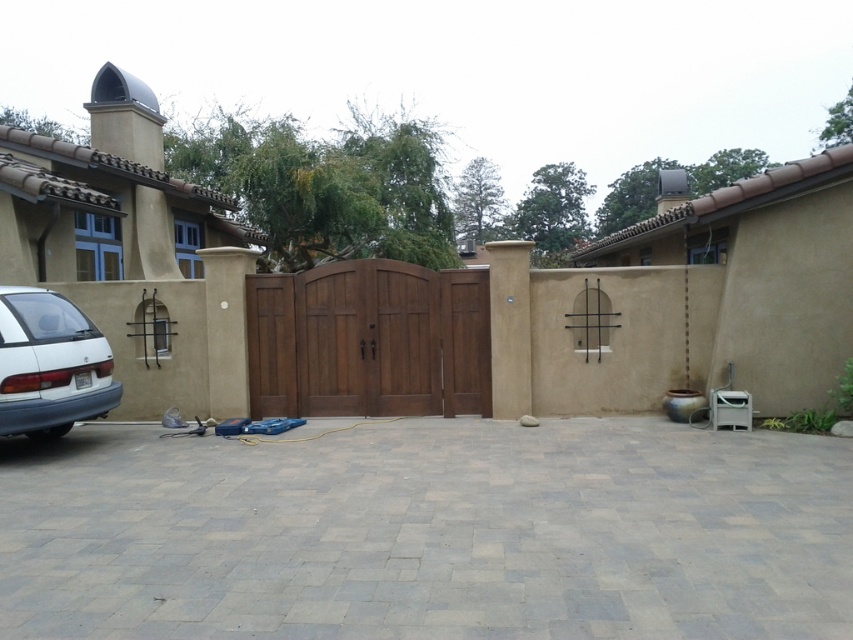
Which is more to the right, white matte hatchback at lower left or wooden gate at center?

From the viewer's perspective, wooden gate at center appears more on the right side.

This screenshot has width=853, height=640. I want to click on white matte hatchback at lower left, so click(x=50, y=364).

Where is `white matte hatchback at lower left`? The height and width of the screenshot is (640, 853). white matte hatchback at lower left is located at coordinates (50, 364).

Image resolution: width=853 pixels, height=640 pixels. Identify the location of gray paver driveway at center. (430, 532).

Is gray paver driveway at center bigger than brown wooden door at center?

Actually, gray paver driveway at center might be smaller than brown wooden door at center.

Which is behind, point (604, 636) or point (490, 416)?

Point (490, 416)

Where is `gray paver driveway at center`? This screenshot has width=853, height=640. gray paver driveway at center is located at coordinates (430, 532).

Is gray paver driveway at center thinner than wooden gate at center?

No.

Between point (231, 484) and point (267, 355), which one is positioned in front?

Positioned in front is point (231, 484).

At what (x,y) coordinates should I click in order to perform the action: click on gray paver driveway at center. Please return your answer as a coordinate pair (x, y). The height and width of the screenshot is (640, 853). Looking at the image, I should click on (430, 532).